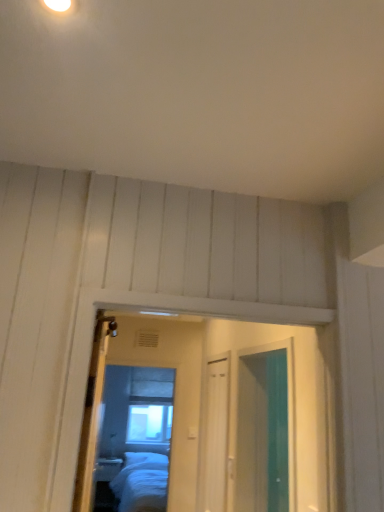
Question: Does matte glass mirror at center appear on the left side of clear glass window at center?

Choices:
 (A) no
 (B) yes

Answer: (A)

Question: From a real-world perspective, is matte glass mirror at center located higher than clear glass window at center?

Choices:
 (A) no
 (B) yes

Answer: (B)

Question: Can you confirm if matte glass mirror at center is shorter than clear glass window at center?

Choices:
 (A) yes
 (B) no

Answer: (B)

Question: Is matte glass mirror at center smaller than clear glass window at center?

Choices:
 (A) yes
 (B) no

Answer: (A)

Question: From the image's perspective, does matte glass mirror at center appear higher than clear glass window at center?

Choices:
 (A) no
 (B) yes

Answer: (B)

Question: Is matte glass mirror at center facing away from clear glass window at center?

Choices:
 (A) yes
 (B) no

Answer: (A)

Question: Can you confirm if wooden door at center is smaller than clear glass window at center?

Choices:
 (A) yes
 (B) no

Answer: (B)

Question: Would you say wooden door at center contains clear glass window at center?

Choices:
 (A) no
 (B) yes

Answer: (A)

Question: Is wooden door at center aimed at clear glass window at center?

Choices:
 (A) yes
 (B) no

Answer: (B)

Question: Is wooden door at center oriented away from clear glass window at center?

Choices:
 (A) no
 (B) yes

Answer: (A)

Question: From a real-world perspective, is wooden door at center beneath clear glass window at center?

Choices:
 (A) yes
 (B) no

Answer: (B)

Question: From a real-world perspective, is wooden door at center positioned over clear glass window at center based on gravity?

Choices:
 (A) no
 (B) yes

Answer: (B)

Question: Is wooden door at center not inside matte glass mirror at center?

Choices:
 (A) yes
 (B) no

Answer: (A)